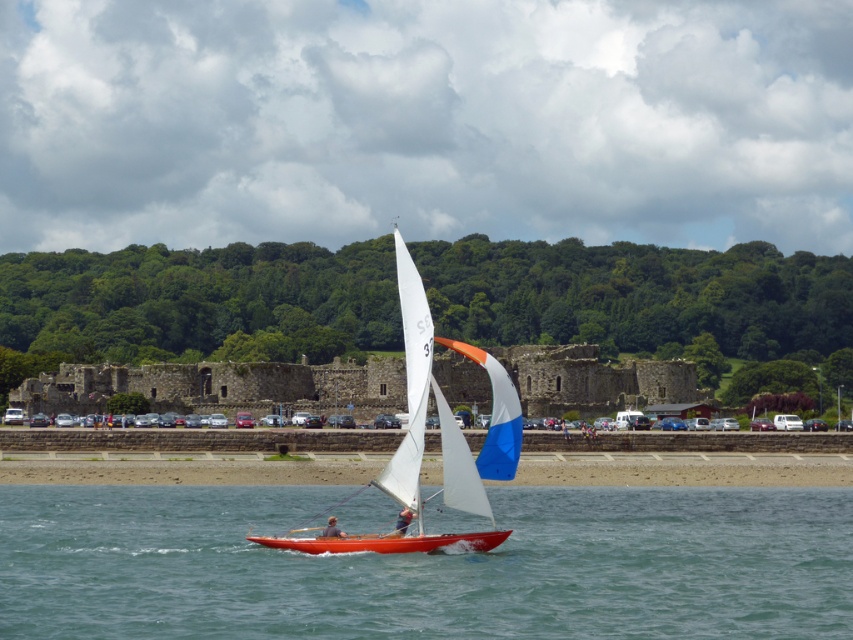
Who is shorter, clear blue water at center or blue fabric sail at center?

blue fabric sail at center

Does clear blue water at center have a lesser height compared to blue fabric sail at center?

No.

Who is more forward, (712, 563) or (410, 516)?

Positioned in front is point (410, 516).

What are the coordinates of `clear blue water at center` in the screenshot? It's located at (427, 564).

Does orange matte sailboat at center have a smaller size compared to blue fabric sail at center?

No.

Is orange matte sailboat at center further to camera compared to blue fabric sail at center?

No, it is in front of blue fabric sail at center.

Between point (419, 515) and point (402, 524), which one is positioned in front?

Positioned in front is point (419, 515).

Where is `orange matte sailboat at center`? The height and width of the screenshot is (640, 853). orange matte sailboat at center is located at coordinates (416, 444).

Can you confirm if clear blue water at center is smaller than orange matte sailboat at center?

Yes, clear blue water at center is smaller than orange matte sailboat at center.

Image resolution: width=853 pixels, height=640 pixels. What do you see at coordinates (427, 564) in the screenshot?
I see `clear blue water at center` at bounding box center [427, 564].

What do you see at coordinates (427, 564) in the screenshot?
I see `clear blue water at center` at bounding box center [427, 564].

Locate an element on the screen. clear blue water at center is located at coordinates (427, 564).